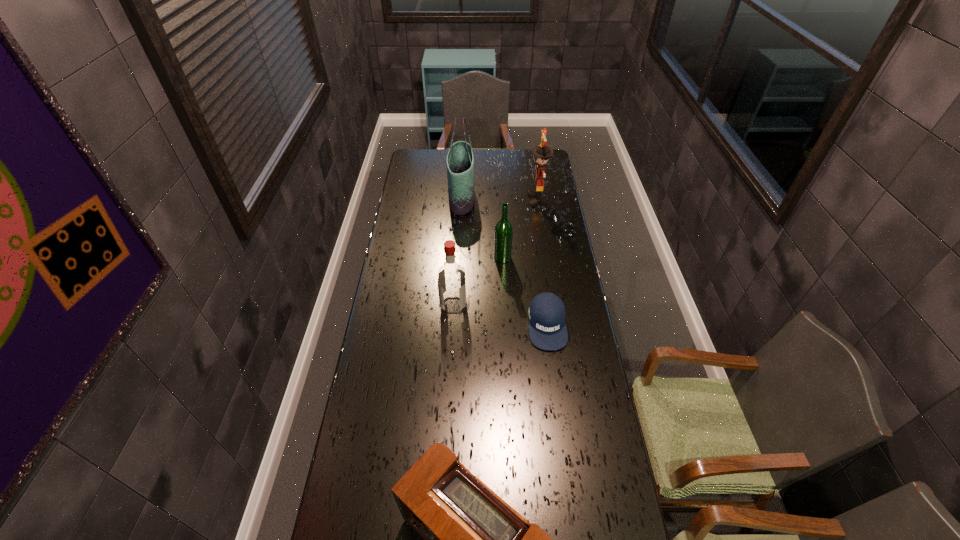
You are a GUI agent. You are given a task and a screenshot of the screen. Output one action in this format:
    pyautogui.click(x=<x>, y=<y>)
    Task: Click on the tote bag
    The height and width of the screenshot is (540, 960).
    Given the screenshot: What is the action you would take?
    pyautogui.click(x=460, y=163)

Identify the location of nutcracker. (542, 152).

Locate an element on the screen. liquor is located at coordinates (451, 280).

Locate an element on the screen. the third farthest object is located at coordinates (503, 234).

Where is `baseball cap`? The width and height of the screenshot is (960, 540). baseball cap is located at coordinates (547, 330).

Where is `free space located on the right of the tote bag`? The height and width of the screenshot is (540, 960). free space located on the right of the tote bag is located at coordinates (519, 198).

What are the coordinates of `vacant area situated 0.280m on the front-facing side of the nutcracker` in the screenshot? It's located at (473, 200).

Where is `free space located on the front-facing side of the nutcracker`? This screenshot has height=540, width=960. free space located on the front-facing side of the nutcracker is located at coordinates (509, 200).

I want to click on vacant region located 0.170m on the front-facing side of the nutcracker, so click(x=494, y=200).

Where is `vacant area situated on the front-facing side of the liquor`? vacant area situated on the front-facing side of the liquor is located at coordinates (523, 306).